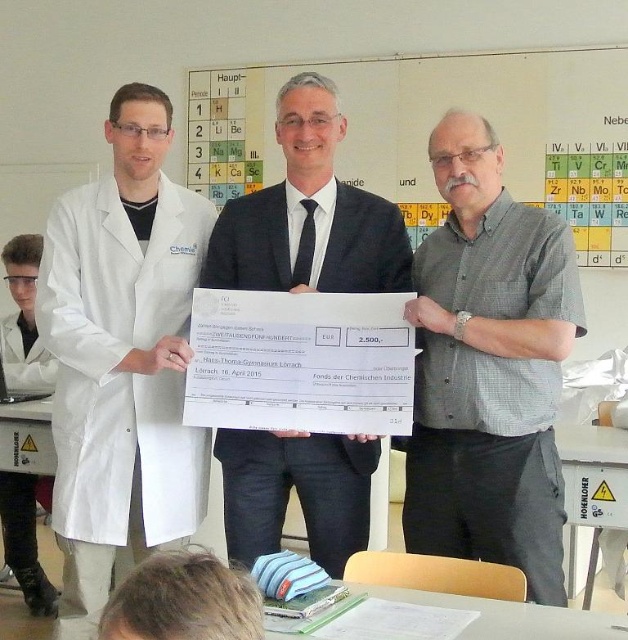
Based on the photo, between white lab coat at left and gray checkered shirt at center, which one appears on the left side from the viewer's perspective?

white lab coat at left

Is white lab coat at left taller than gray checkered shirt at center?

Correct, white lab coat at left is much taller as gray checkered shirt at center.

The image size is (628, 640). What are the coordinates of `white lab coat at left` in the screenshot? It's located at (122, 358).

Locate an element on the screen. This screenshot has width=628, height=640. white lab coat at left is located at coordinates (122, 358).

Can you confirm if white lab coat at left is positioned below yellow periodic table at upper center?

Indeed, white lab coat at left is positioned under yellow periodic table at upper center.

Locate an element on the screen. Image resolution: width=628 pixels, height=640 pixels. white lab coat at left is located at coordinates (122, 358).

Who is more forward, (127,275) or (558,164)?

Point (127,275)

I want to click on white lab coat at left, so click(122, 358).

Who is shorter, yellow periodic table at upper center or white lab coat at center?

white lab coat at center is shorter.

Between yellow periodic table at upper center and white lab coat at center, which one appears on the right side from the viewer's perspective?

Positioned to the right is yellow periodic table at upper center.

Is point (414, 102) in front of point (359, 536)?

No, (414, 102) is further to viewer.

Locate an element on the screen. yellow periodic table at upper center is located at coordinates (430, 129).